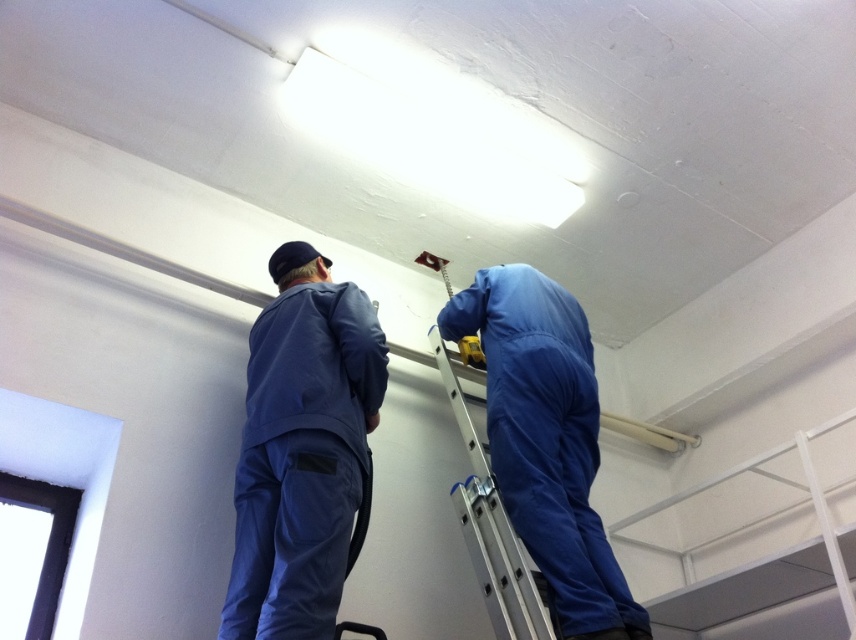
Does blue fabric jumpsuit at center appear under blue matte jumpsuit at upper center?

Actually, blue fabric jumpsuit at center is above blue matte jumpsuit at upper center.

Who is lower down, blue fabric jumpsuit at center or blue matte jumpsuit at upper center?

Positioned lower is blue matte jumpsuit at upper center.

Who is more distant from viewer, [321,563] or [538,362]?

The point [538,362] is more distant.

What are the coordinates of `blue fabric jumpsuit at center` in the screenshot? It's located at (301, 449).

Which is above, blue matte jumpsuit at upper center or silver metallic ladder at upper center?

blue matte jumpsuit at upper center is higher up.

Between blue matte jumpsuit at upper center and silver metallic ladder at upper center, which one has more height?

Standing taller between the two is blue matte jumpsuit at upper center.

Who is more distant from viewer, (515, 316) or (506, 634)?

The point (515, 316) is more distant.

The height and width of the screenshot is (640, 856). I want to click on blue matte jumpsuit at upper center, so click(x=545, y=442).

Which is behind, point (314, 632) or point (508, 541)?

Point (508, 541)

Can you confirm if blue fabric jumpsuit at center is thinner than silver metallic ladder at upper center?

Incorrect, blue fabric jumpsuit at center's width is not less than silver metallic ladder at upper center's.

The width and height of the screenshot is (856, 640). Identify the location of blue fabric jumpsuit at center. (301, 449).